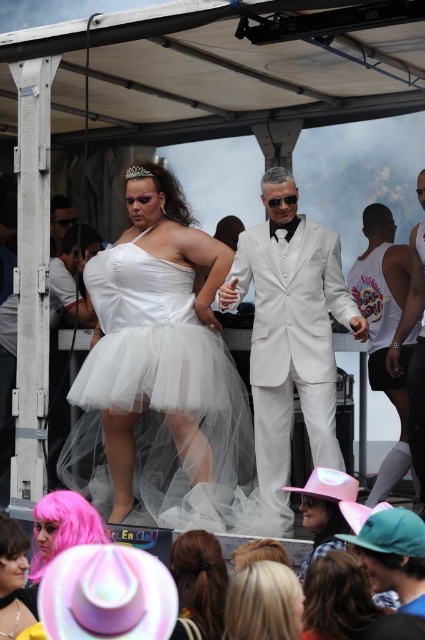
Question: Among these objects, which one is farthest from the camera?

Choices:
 (A) white satin suit at center
 (B) black matte wig at center
 (C) blonde hair at center

Answer: (B)

Question: Which of the following is the closest to the observer?

Choices:
 (A) black matte wig at center
 (B) pink synthetic wig at lower left

Answer: (B)

Question: Can you confirm if blonde hair at center is positioned below pink felt cowboy hat at lower center?

Choices:
 (A) no
 (B) yes

Answer: (B)

Question: Where is pink felt cowboy hat at lower center located in relation to white tulle wig at center in the image?

Choices:
 (A) right
 (B) left

Answer: (A)

Question: Which object is closer to the camera taking this photo?

Choices:
 (A) blonde hair at center
 (B) white tulle dress at center
 (C) pink felt cowboy hat at lower center

Answer: (A)

Question: Can you confirm if white matte tank top at right is wider than smooth brown hair at center?

Choices:
 (A) yes
 (B) no

Answer: (A)